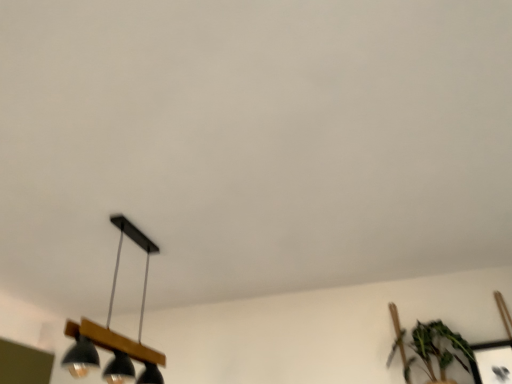
Question: Can you confirm if black matte/wooden lamp at lower left is positioned to the left of metallic silver picture frame at lower right?

Choices:
 (A) yes
 (B) no

Answer: (A)

Question: Is black matte/wooden lamp at lower left shorter than metallic silver picture frame at lower right?

Choices:
 (A) yes
 (B) no

Answer: (B)

Question: Is the depth of black matte/wooden lamp at lower left greater than that of metallic silver picture frame at lower right?

Choices:
 (A) yes
 (B) no

Answer: (B)

Question: From a real-world perspective, is black matte/wooden lamp at lower left under metallic silver picture frame at lower right?

Choices:
 (A) no
 (B) yes

Answer: (A)

Question: From a real-world perspective, is black matte/wooden lamp at lower left on metallic silver picture frame at lower right?

Choices:
 (A) no
 (B) yes

Answer: (B)

Question: Is black matte/wooden lamp at lower left spatially inside green leafy plant at lower right, or outside of it?

Choices:
 (A) inside
 (B) outside

Answer: (B)

Question: In terms of size, does black matte/wooden lamp at lower left appear bigger or smaller than green leafy plant at lower right?

Choices:
 (A) big
 (B) small

Answer: (A)

Question: From a real-world perspective, is black matte/wooden lamp at lower left above or below green leafy plant at lower right?

Choices:
 (A) above
 (B) below

Answer: (A)

Question: Looking at their shapes, would you say black matte/wooden lamp at lower left is wider or thinner than green leafy plant at lower right?

Choices:
 (A) thin
 (B) wide

Answer: (A)

Question: Is black matte/wooden lamp at lower left situated inside metallic silver picture frame at lower right or outside?

Choices:
 (A) outside
 (B) inside

Answer: (A)

Question: Visually, is black matte/wooden lamp at lower left positioned to the left or to the right of metallic silver picture frame at lower right?

Choices:
 (A) right
 (B) left

Answer: (B)

Question: Is black matte/wooden lamp at lower left taller or shorter than metallic silver picture frame at lower right?

Choices:
 (A) short
 (B) tall

Answer: (B)

Question: In the image, is black matte/wooden lamp at lower left positioned in front of or behind metallic silver picture frame at lower right?

Choices:
 (A) behind
 (B) front

Answer: (B)

Question: Is metallic silver picture frame at lower right taller or shorter than green leafy plant at lower right?

Choices:
 (A) short
 (B) tall

Answer: (A)

Question: Does point (501, 380) appear closer or farther from the camera than point (418, 344)?

Choices:
 (A) closer
 (B) farther

Answer: (A)